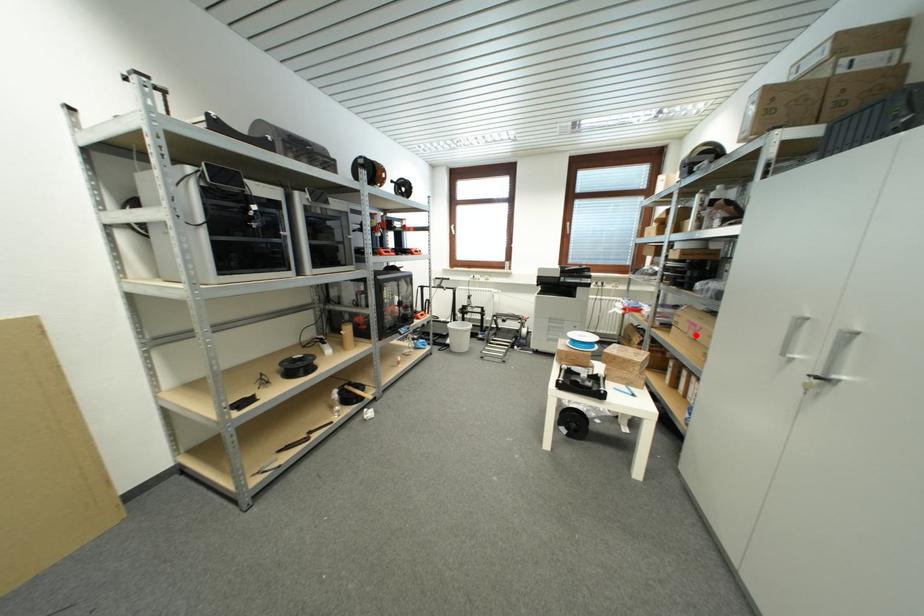
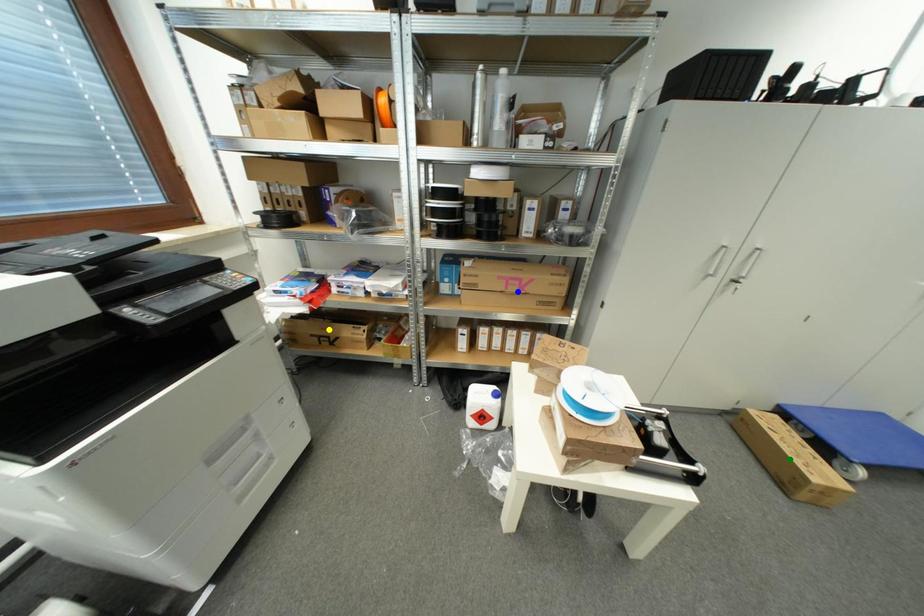
Question: I am providing you with two images of the same scene from different viewpoints. A red point is marked on the first image. You are given multiple points on the second image. Which point in image 2 represents the same 3d spot as the red point in image 1?

Choices:
 (A) green point
 (B) blue point
 (C) yellow point

Answer: (B)